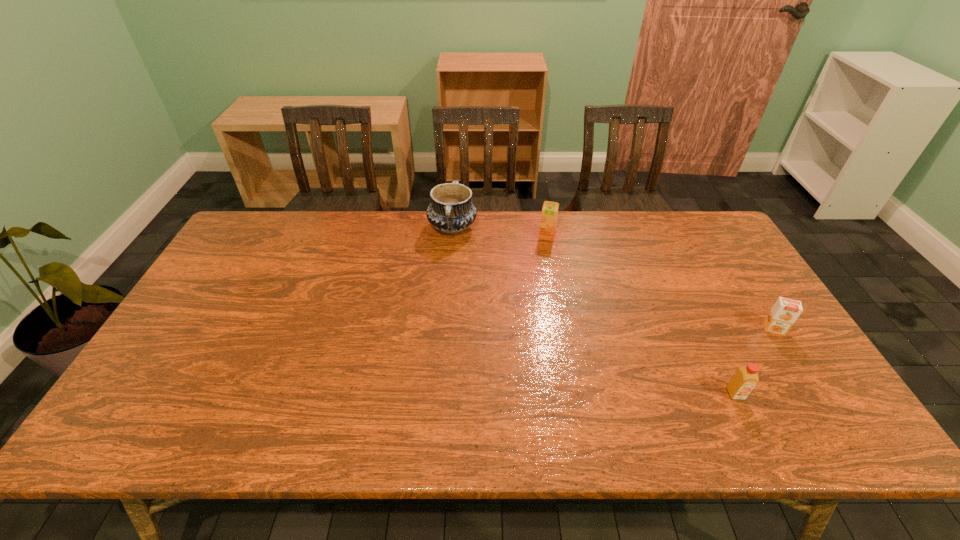
Where is `free region at the far right corner of the desktop`? The width and height of the screenshot is (960, 540). free region at the far right corner of the desktop is located at coordinates (707, 231).

Where is `free space between the rightmost object and the farthest orange juice`? The height and width of the screenshot is (540, 960). free space between the rightmost object and the farthest orange juice is located at coordinates (660, 282).

The width and height of the screenshot is (960, 540). What are the coordinates of `free spot between the pottery and the tallest orange juice` in the screenshot? It's located at (499, 232).

Find the location of a particular element. vacant space that's between the nearest object and the leftmost orange juice is located at coordinates (641, 315).

Locate an element on the screen. vacant area that lies between the pottery and the third farthest object is located at coordinates [613, 278].

The image size is (960, 540). In order to click on free spot between the third object from left to right and the rightmost orange juice in this screenshot , I will do (755, 361).

Identify the location of vacant space that is in between the second nearest object and the nearest object. (755, 361).

You are a GUI agent. You are given a task and a screenshot of the screen. Output one action in this format:
    pyautogui.click(x=<x>, y=<y>)
    Task: Click on the empty space that is in between the third object from right to left and the third object from left to right
    The width and height of the screenshot is (960, 540).
    Given the screenshot: What is the action you would take?
    pyautogui.click(x=641, y=315)

Where is `vacant area between the second nearest object and the pottery`? vacant area between the second nearest object and the pottery is located at coordinates (613, 278).

Image resolution: width=960 pixels, height=540 pixels. I want to click on blank region between the rightmost orange juice and the leftmost object, so click(x=613, y=278).